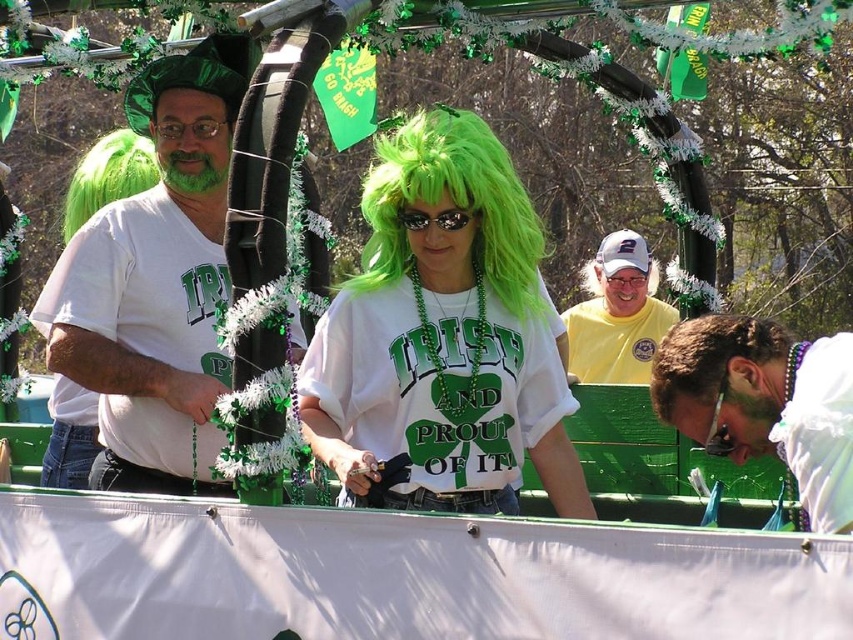
You are a photographer at the St. Patrick Day parade. You want to take a photo of the yellow cotton shirt at upper center and the green synthetic wig at upper left. Which one is positioned to the right side of the other?

The yellow cotton shirt at upper center is positioned to the right of the green synthetic wig at upper left.

You are a photographer at the St. Patrick Day parade. You want to take a photo of the float with both the yellow cotton shirt at upper center and the green synthetic wig at upper left. However, your camera has a limited focus range. Which object should you focus on first if you want to ensure the closest one is in focus?

The yellow cotton shirt at upper center should be focused on first because its width is less than the green synthetic wig at upper left, indicating it is closer to the camera.